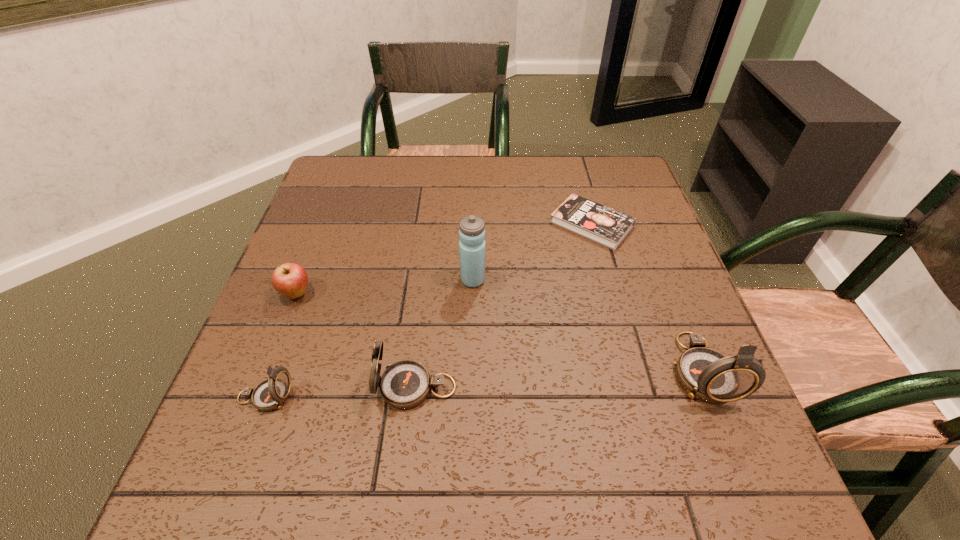
You are a GUI agent. You are given a task and a screenshot of the screen. Output one action in this format:
    pyautogui.click(x=<x>, y=<y>)
    Task: Click on the vacant space located on the face of the second tallest compass
    The image size is (960, 540).
    Given the screenshot: What is the action you would take?
    pyautogui.click(x=337, y=387)

Locate an element on the screen. This screenshot has height=540, width=960. vacant space located on the face of the second tallest compass is located at coordinates (294, 387).

In order to click on free space located on the back of the apple in this screenshot , I will do `click(322, 228)`.

The height and width of the screenshot is (540, 960). I want to click on vacant space located 0.080m on the left of the shortest object, so click(519, 224).

This screenshot has width=960, height=540. I want to click on vacant position located on the left of the third object from right to left, so click(x=425, y=280).

This screenshot has height=540, width=960. Identify the location of object that is at the far edge. (608, 227).

This screenshot has width=960, height=540. Identify the location of compass positioned at the left edge. (270, 394).

Find the location of a particular element. apple situated at the left edge is located at coordinates (289, 279).

What are the coordinates of `compass at the right edge` in the screenshot? It's located at (706, 374).

This screenshot has height=540, width=960. I want to click on book present at the right edge, so click(608, 227).